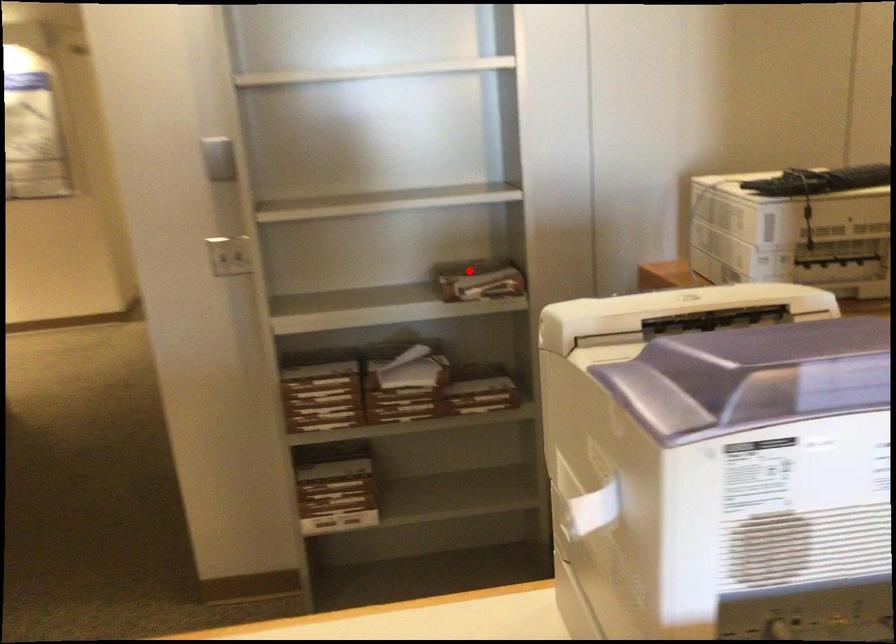
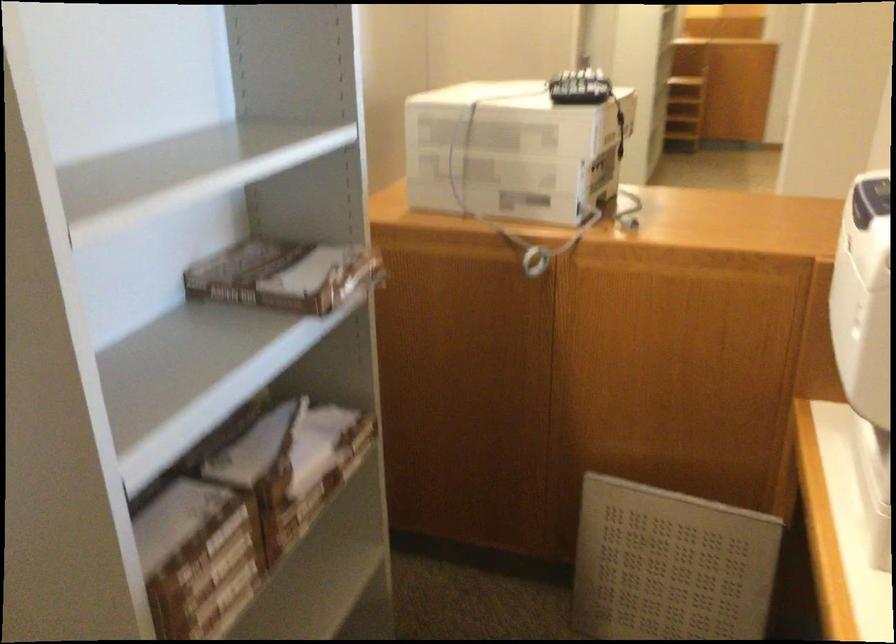
Locate, in the second image, the point that corresponds to the highlighted location in the first image.

(280, 275)